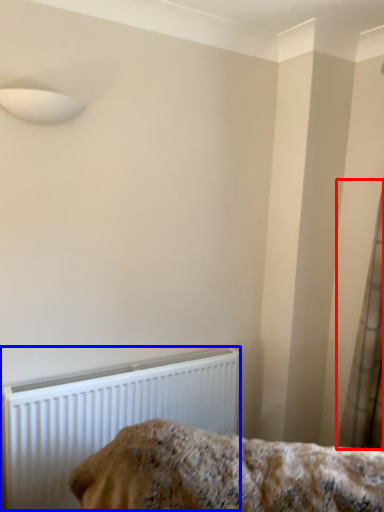
Question: Which object is closer to the camera taking this photo, curtain (highlighted by a red box) or radiator (highlighted by a blue box)?

Choices:
 (A) curtain
 (B) radiator

Answer: (B)